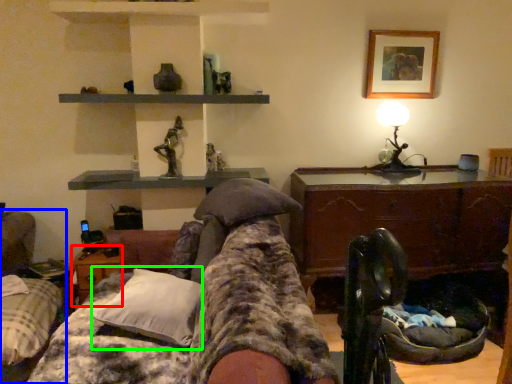
Question: Estimate the real-world distances between objects in this image. Which object is farther from table (highlighted by a red box), furniture (highlighted by a blue box) or pillow (highlighted by a green box)?

Choices:
 (A) furniture
 (B) pillow

Answer: (B)